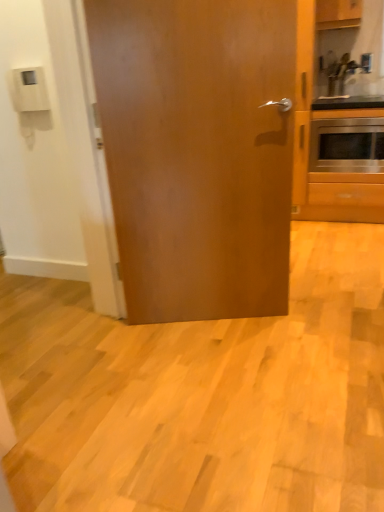
I want to click on vacant area that is in front of glossy wood door at center, so click(223, 372).